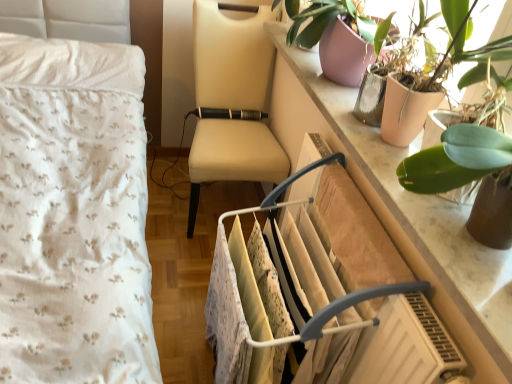
Image resolution: width=512 pixels, height=384 pixels. What do you see at coordinates (232, 101) in the screenshot?
I see `beige leather chair at center` at bounding box center [232, 101].

Find the location of a particular element. This screenshot has width=512, height=384. marble counter top at upper right is located at coordinates (402, 211).

In the scene shown: What is the approximate width of green leafy plant at upper right, the first houseplant in the front-to-back sequence?

green leafy plant at upper right, the first houseplant in the front-to-back sequence, is 8.67 inches in width.

At what (x,y) coordinates should I click in order to perform the action: click on beige leather chair at center. Please return your answer as a coordinate pair (x, y). The image size is (512, 384). Looking at the image, I should click on (232, 101).

Consider the image. Is marble counter top at upper right next to matte pink pot at upper right, placed as the first houseplant when sorted from back to front, and touching it?

No, marble counter top at upper right is not with matte pink pot at upper right, placed as the first houseplant when sorted from back to front.

Is point (306, 52) positioned behind point (496, 45)?

Yes, it is.

Considering the sizes of objects marble counter top at upper right and matte pink pot at upper right, which is the second houseplant in front-to-back order, in the image provided, who is thinner, marble counter top at upper right or matte pink pot at upper right, which is the second houseplant in front-to-back order,?

marble counter top at upper right is thinner.

How many degrees apart are the facing directions of marble counter top at upper right and matte pink pot at upper right, which is the second houseplant in front-to-back order?

marble counter top at upper right and matte pink pot at upper right, which is the second houseplant in front-to-back order, are facing 1.82 degrees away from each other.

In the scene shown: Between matte pink pot at upper right, which is the second houseplant in front-to-back order, and white plastic clothes rack at center, which one has less height?

With less height is matte pink pot at upper right, which is the second houseplant in front-to-back order.

Measure the distance from matte pink pot at upper right, which is the second houseplant in front-to-back order, to white plastic clothes rack at center.

matte pink pot at upper right, which is the second houseplant in front-to-back order, and white plastic clothes rack at center are 20.19 inches apart from each other.

Who is smaller, matte pink pot at upper right, which is the second houseplant in front-to-back order, or white plastic clothes rack at center?

matte pink pot at upper right, which is the second houseplant in front-to-back order.

From the picture: Can you confirm if matte pink pot at upper right, which is the second houseplant in front-to-back order, is wider than white plastic clothes rack at center?

No, matte pink pot at upper right, which is the second houseplant in front-to-back order, is not wider than white plastic clothes rack at center.

Is white plastic clothes rack at center in contact with green leafy plant at upper right, the first houseplant in the front-to-back sequence?

They are not placed beside each other.

How different are the orientations of white plastic clothes rack at center and green leafy plant at upper right, the first houseplant in the front-to-back sequence, in degrees?

The facing directions of white plastic clothes rack at center and green leafy plant at upper right, the first houseplant in the front-to-back sequence, are 0.0872 degrees apart.

Relative to green leafy plant at upper right, which appears as the 2th houseplant when viewed from the back, is white plastic clothes rack at center in front or behind?

Clearly, white plastic clothes rack at center is behind green leafy plant at upper right, which appears as the 2th houseplant when viewed from the back.

Considering the relative sizes of marble counter top at upper right and green leafy plant at upper right, the first houseplant in the front-to-back sequence, in the image provided, is marble counter top at upper right bigger than green leafy plant at upper right, the first houseplant in the front-to-back sequence,?

Correct, marble counter top at upper right is larger in size than green leafy plant at upper right, the first houseplant in the front-to-back sequence.

From the image's perspective, does marble counter top at upper right appear higher than green leafy plant at upper right, which appears as the 2th houseplant when viewed from the back?

Yes.

Is marble counter top at upper right looking in the opposite direction of green leafy plant at upper right, the first houseplant in the front-to-back sequence?

No.

Consider the image. How different are the orientations of marble counter top at upper right and green leafy plant at upper right, which appears as the 2th houseplant when viewed from the back, in degrees?

marble counter top at upper right and green leafy plant at upper right, which appears as the 2th houseplant when viewed from the back, are facing 1.11 degrees away from each other.

Is matte pink pot at upper right, which is the second houseplant in front-to-back order, facing away from green leafy plant at upper right, which appears as the 2th houseplant when viewed from the back?

That's not correct — matte pink pot at upper right, which is the second houseplant in front-to-back order, is not looking away from green leafy plant at upper right, which appears as the 2th houseplant when viewed from the back.

Which point is more distant from viewer, (412, 115) or (501, 151)?

Positioned behind is point (412, 115).

Which of these two, matte pink pot at upper right, which is the second houseplant in front-to-back order, or green leafy plant at upper right, the first houseplant in the front-to-back sequence, is smaller?

green leafy plant at upper right, the first houseplant in the front-to-back sequence, is smaller.

From the image's perspective, which is above, matte pink pot at upper right, which is the second houseplant in front-to-back order, or green leafy plant at upper right, the first houseplant in the front-to-back sequence?

matte pink pot at upper right, which is the second houseplant in front-to-back order, from the image's perspective.

Is green leafy plant at upper right, which appears as the 2th houseplant when viewed from the back, not inside marble counter top at upper right?

green leafy plant at upper right, which appears as the 2th houseplant when viewed from the back, is positioned outside marble counter top at upper right.

Is green leafy plant at upper right, which appears as the 2th houseplant when viewed from the back, facing towards marble counter top at upper right?

No, green leafy plant at upper right, which appears as the 2th houseplant when viewed from the back, does not turn towards marble counter top at upper right.

Considering the sizes of objects green leafy plant at upper right, which appears as the 2th houseplant when viewed from the back, and marble counter top at upper right in the image provided, who is bigger, green leafy plant at upper right, which appears as the 2th houseplant when viewed from the back, or marble counter top at upper right?

marble counter top at upper right.

Is green leafy plant at upper right, which appears as the 2th houseplant when viewed from the back, taller than marble counter top at upper right?

Correct, green leafy plant at upper right, which appears as the 2th houseplant when viewed from the back, is much taller as marble counter top at upper right.

How different are the orientations of beige leather chair at center and white plastic clothes rack at center in degrees?

88 degrees.

Would you say beige leather chair at center is to the left or to the right of white plastic clothes rack at center in the picture?

beige leather chair at center is to the left of white plastic clothes rack at center.

In the scene shown: From the image's perspective, is beige leather chair at center positioned above or below white plastic clothes rack at center?

Based on their image positions, beige leather chair at center is located above white plastic clothes rack at center.

Is beige leather chair at center in front of or behind white plastic clothes rack at center in the image?

Clearly, beige leather chair at center is behind white plastic clothes rack at center.

The height and width of the screenshot is (384, 512). I want to click on counter top on the left side of matte pink pot at upper right, placed as the first houseplant when sorted from back to front, so click(x=402, y=211).

Locate an element on the screen. The width and height of the screenshot is (512, 384). the 2nd houseplant above the white plastic clothes rack at center (from the image's perspective) is located at coordinates (475, 49).

Considering their positions, is marble counter top at upper right positioned closer to green leafy plant at upper right, which appears as the 2th houseplant when viewed from the back, than matte pink pot at upper right, which is the second houseplant in front-to-back order?

Among the two, matte pink pot at upper right, which is the second houseplant in front-to-back order, is located nearer to green leafy plant at upper right, which appears as the 2th houseplant when viewed from the back.

Estimate the real-world distances between objects in this image. Which object is closer to beige leather chair at center, white plastic clothes rack at center or green leafy plant at upper right, the first houseplant in the front-to-back sequence?

white plastic clothes rack at center.

Considering their positions, is marble counter top at upper right positioned closer to matte pink pot at upper right, which is the second houseplant in front-to-back order, than green leafy plant at upper right, which appears as the 2th houseplant when viewed from the back?

Among the two, green leafy plant at upper right, which appears as the 2th houseplant when viewed from the back, is located nearer to matte pink pot at upper right, which is the second houseplant in front-to-back order.

When comparing their distances from beige leather chair at center, does green leafy plant at upper right, which appears as the 2th houseplant when viewed from the back, or marble counter top at upper right seem further?

green leafy plant at upper right, which appears as the 2th houseplant when viewed from the back, is positioned further to the anchor beige leather chair at center.

Looking at the image, which one is located further to white plastic clothes rack at center, marble counter top at upper right or beige leather chair at center?

beige leather chair at center lies further to white plastic clothes rack at center than the other object.

Which object lies further to the anchor point green leafy plant at upper right, the first houseplant in the front-to-back sequence, white plastic clothes rack at center or beige leather chair at center?

beige leather chair at center.

Estimate the real-world distances between objects in this image. Which object is further from matte pink pot at upper right, placed as the first houseplant when sorted from back to front, white plastic clothes rack at center or beige leather chair at center?

beige leather chair at center is further to matte pink pot at upper right, placed as the first houseplant when sorted from back to front.

When comparing their distances from green leafy plant at upper right, which appears as the 2th houseplant when viewed from the back, does matte pink pot at upper right, which is the second houseplant in front-to-back order, or marble counter top at upper right seem closer?

The object closer to green leafy plant at upper right, which appears as the 2th houseplant when viewed from the back, is matte pink pot at upper right, which is the second houseplant in front-to-back order.

This screenshot has width=512, height=384. Identify the location of houseplant located between green leafy plant at upper right, which appears as the 2th houseplant when viewed from the back, and beige leather chair at center in the depth direction. (475, 49).

You are a GUI agent. You are given a task and a screenshot of the screen. Output one action in this format:
    pyautogui.click(x=<x>, y=<y>)
    Task: Click on the houseplant between marble counter top at upper right and matte pink pot at upper right, which is the second houseplant in front-to-back order, from front to back
    
    Given the screenshot: What is the action you would take?
    (x=471, y=168)

Where is `houseplant between marble counter top at upper right and white plastic clothes rack at center vertically`? houseplant between marble counter top at upper right and white plastic clothes rack at center vertically is located at coordinates (471, 168).

Image resolution: width=512 pixels, height=384 pixels. Identify the location of closet between green leafy plant at upper right, which appears as the 2th houseplant when viewed from the back, and beige leather chair at center in the front-back direction. (285, 296).